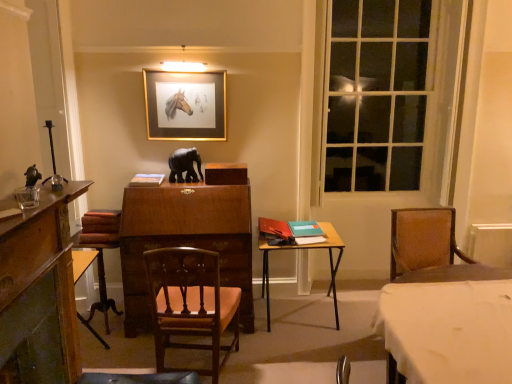
What are the coordinates of `unoccupied region to the right of wooden table at center, which is counted as the second table, starting from the front` in the screenshot? It's located at (357, 318).